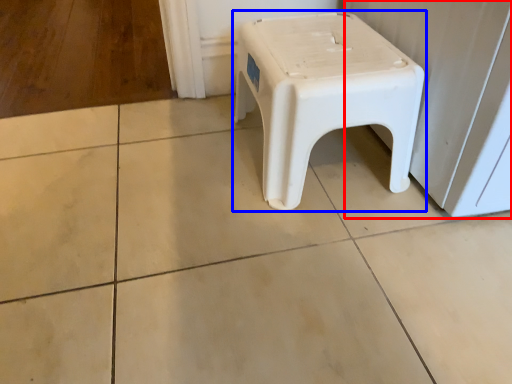
Question: Which object is further to the camera taking this photo, screen door (highlighted by a red box) or stool (highlighted by a blue box)?

Choices:
 (A) screen door
 (B) stool

Answer: (B)